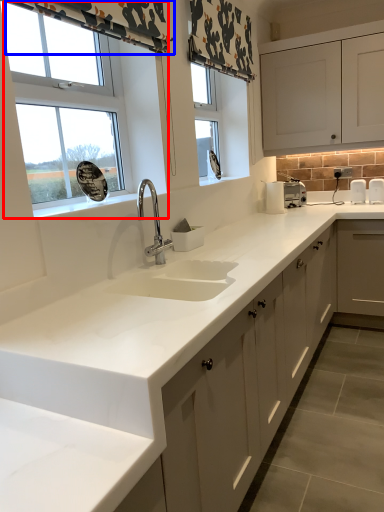
Question: Among these objects, which one is farthest to the camera, window (highlighted by a red box) or curtain (highlighted by a blue box)?

Choices:
 (A) window
 (B) curtain

Answer: (A)